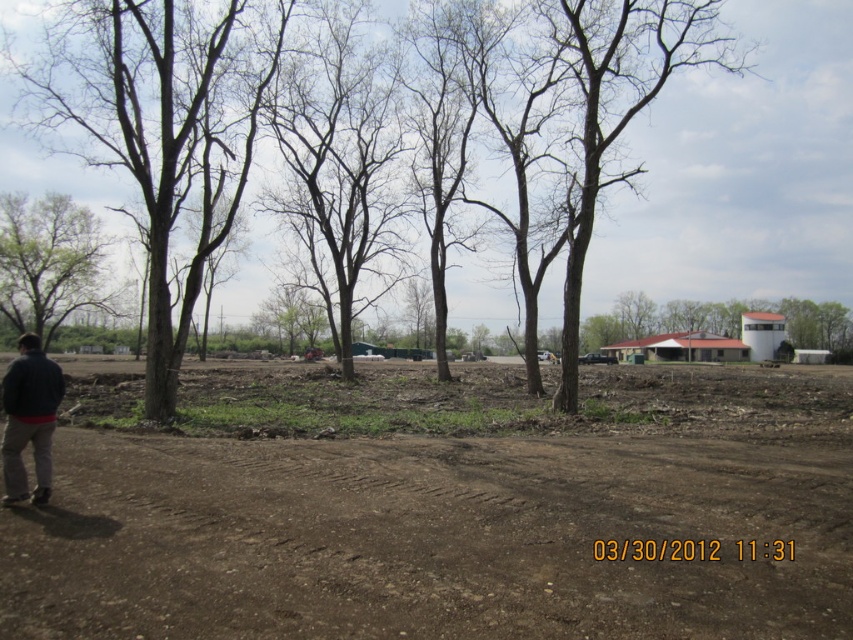
Based on the photo, you are standing at the dirt road in the foreground of the image. You see two points marked on the ground. The first point is at coordinates point (595,573) and the second point is at point (32,353). Which point is closer to you?

Point (595,573) is in front of point (32,353), so the first point is closer to you.

You are standing at the edge of the green leafy tree at left and want to walk to the brown dirt track at center. Which direction should you move relative to the tree?

You should move towards the brown dirt track at center, which is in front of the green leafy tree at left, so you need to walk forward away from the tree to reach the track.